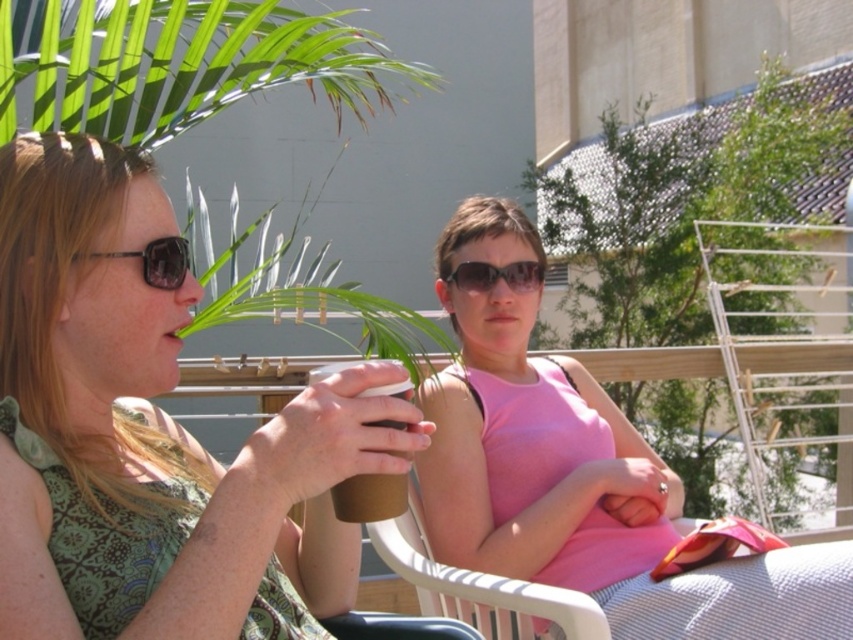
Question: Is pink fabric dress at center bigger than matte black sunglasses at left?

Choices:
 (A) no
 (B) yes

Answer: (B)

Question: Considering the relative positions of matte green dress at left and pink fabric dress at center in the image provided, where is matte green dress at left located with respect to pink fabric dress at center?

Choices:
 (A) above
 (B) below

Answer: (A)

Question: Which object appears closest to the camera in this image?

Choices:
 (A) brown paper cup at center
 (B) sunglasses at center
 (C) matte green dress at left

Answer: (C)

Question: Which of the following is the farthest from the observer?

Choices:
 (A) brown paper cup at center
 (B) matte black sunglasses at left
 (C) sunglasses at center

Answer: (C)

Question: Among these points, which one is nearest to the camera?

Choices:
 (A) (676, 582)
 (B) (132, 248)
 (C) (167, 268)

Answer: (B)

Question: Can you confirm if brown paper cup at center is positioned below matte black sunglasses at left?

Choices:
 (A) no
 (B) yes

Answer: (B)